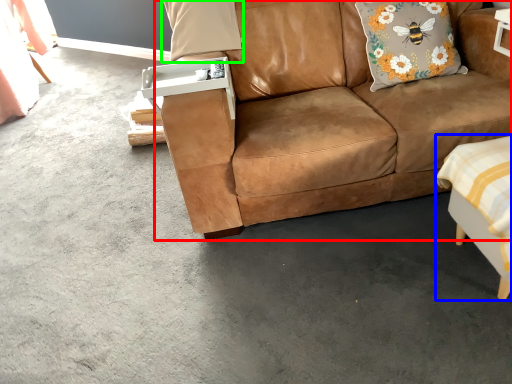
Question: Estimate the real-world distances between objects in this image. Which object is farther from studio couch (highlighted by a red box), swivel chair (highlighted by a blue box) or pillow (highlighted by a green box)?

Choices:
 (A) swivel chair
 (B) pillow

Answer: (B)